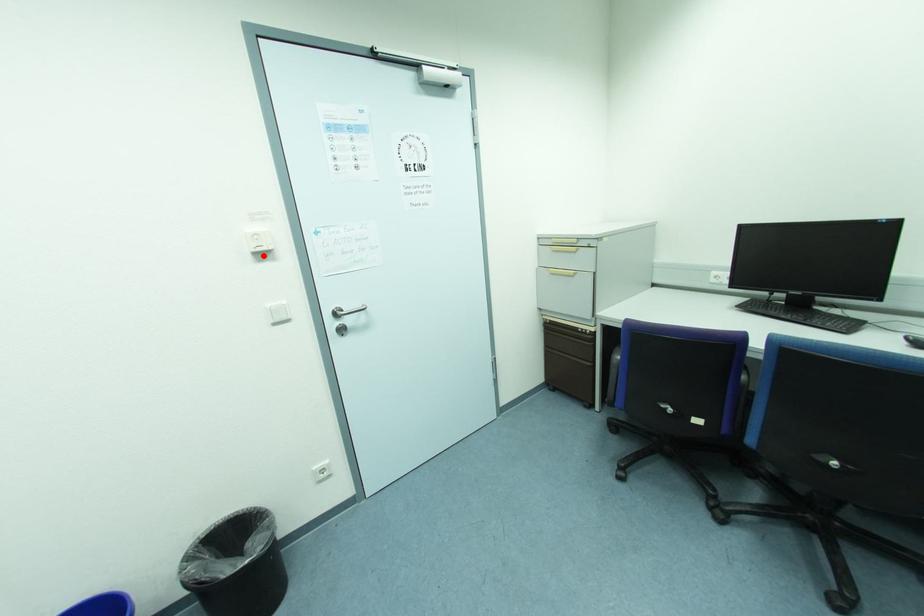
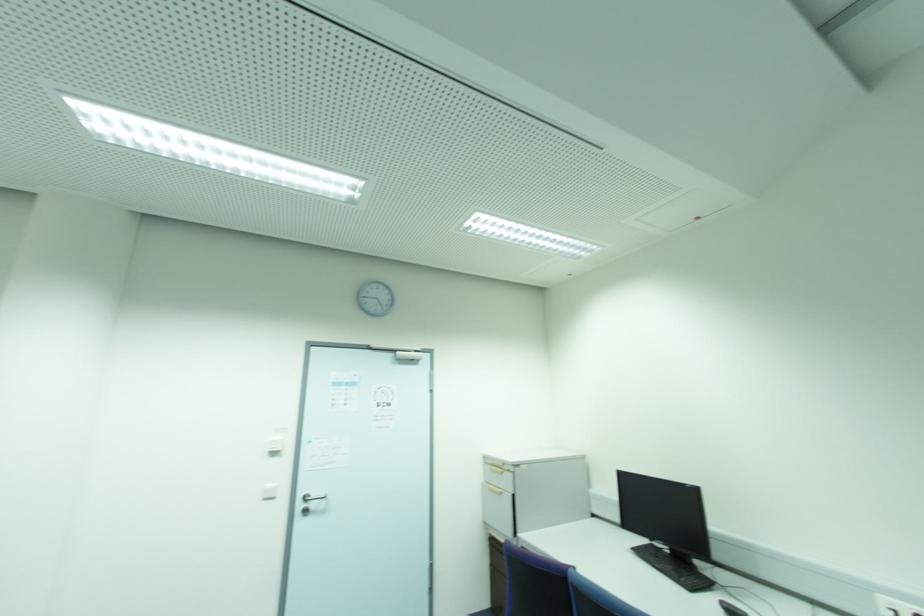
Question: I am providing you with two images of the same scene from different viewpoints. A red point is marked on the first image. At the location where the point appears in image 1, is it still visible in image 2?

Choices:
 (A) Yes
 (B) No

Answer: (A)